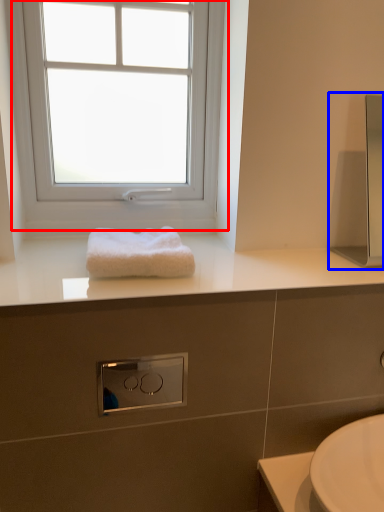
Question: Which of the following is the closest to the observer, window (highlighted by a red box) or medicine cabinet (highlighted by a blue box)?

Choices:
 (A) window
 (B) medicine cabinet

Answer: (B)